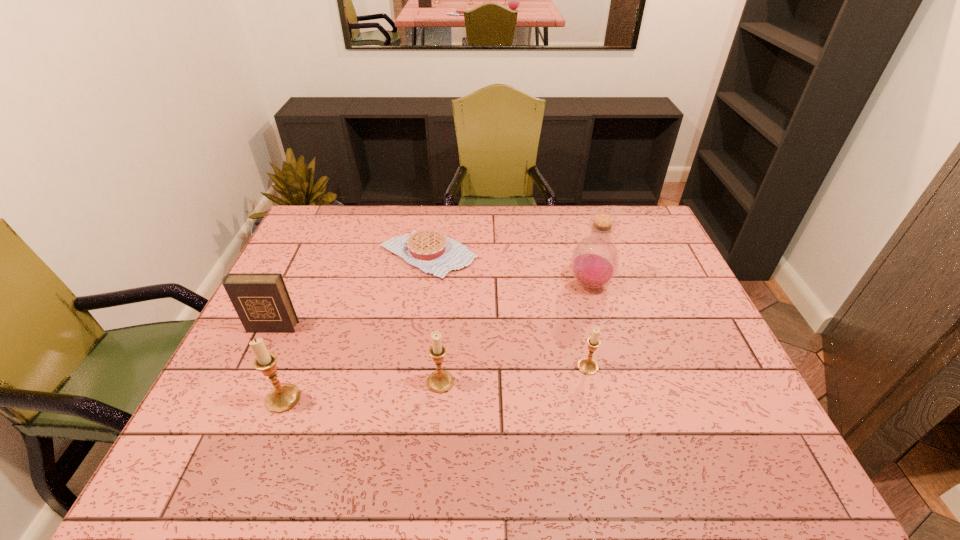
The height and width of the screenshot is (540, 960). In order to click on the leftmost candle holder in this screenshot , I will do `click(283, 397)`.

In order to click on the second candle holder from left to right in this screenshot , I will do `click(440, 381)`.

Image resolution: width=960 pixels, height=540 pixels. Find the location of `the second shortest object`. the second shortest object is located at coordinates [x=588, y=366].

The image size is (960, 540). Find the location of `the rightmost candle holder`. the rightmost candle holder is located at coordinates (588, 366).

Where is `the shortest object`? The image size is (960, 540). the shortest object is located at coordinates (431, 251).

Identify the location of the fourth nearest object. 261,300.

At what (x,y) coordinates should I click in order to perform the action: click on bottle. Please return your answer as a coordinate pair (x, y). The width and height of the screenshot is (960, 540). Looking at the image, I should click on (594, 262).

Identify the location of vacant space located on the right of the leftmost candle holder. The height and width of the screenshot is (540, 960). (457, 399).

Locate an element on the screen. This screenshot has height=540, width=960. free space located on the left of the second candle holder from right to left is located at coordinates (284, 382).

Find the location of `free location located 0.340m on the right of the second shortest object`. free location located 0.340m on the right of the second shortest object is located at coordinates (733, 367).